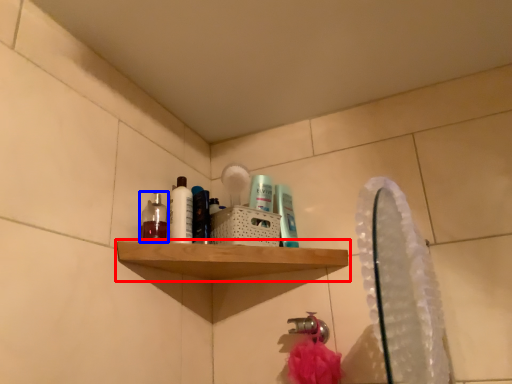
Question: Among these objects, which one is nearest to the camera, shelf (highlighted by a red box) or mouthwash (highlighted by a blue box)?

Choices:
 (A) shelf
 (B) mouthwash

Answer: (A)